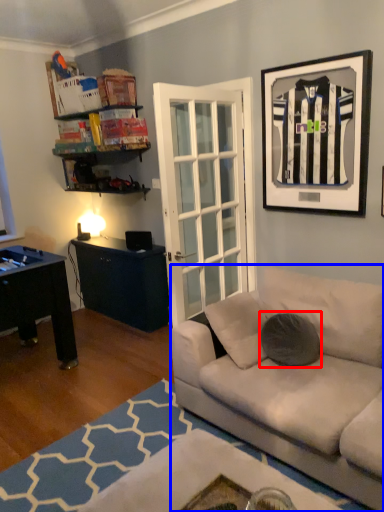
Question: Among these objects, which one is nearest to the camera, pillow (highlighted by a red box) or studio couch (highlighted by a blue box)?

Choices:
 (A) pillow
 (B) studio couch

Answer: (B)